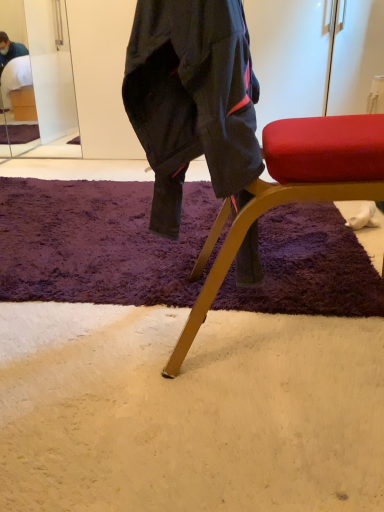
Question: From the image's perspective, is purple shaggy rug at center below metallic gold chair at center?

Choices:
 (A) yes
 (B) no

Answer: (A)

Question: Does purple shaggy rug at center have a greater width compared to metallic gold chair at center?

Choices:
 (A) no
 (B) yes

Answer: (B)

Question: Is the position of purple shaggy rug at center less distant than that of metallic gold chair at center?

Choices:
 (A) yes
 (B) no

Answer: (B)

Question: Is purple shaggy rug at center aimed at metallic gold chair at center?

Choices:
 (A) yes
 (B) no

Answer: (B)

Question: Can you confirm if purple shaggy rug at center is positioned to the left of metallic gold chair at center?

Choices:
 (A) yes
 (B) no

Answer: (A)

Question: From a real-world perspective, is purple shaggy rug at center physically above metallic gold chair at center?

Choices:
 (A) no
 (B) yes

Answer: (A)

Question: Does purple shaggy rug at center come behind clear glass mirror at upper left?

Choices:
 (A) no
 (B) yes

Answer: (A)

Question: Can you confirm if purple shaggy rug at center is thinner than clear glass mirror at upper left?

Choices:
 (A) no
 (B) yes

Answer: (A)

Question: Can we say purple shaggy rug at center lies outside clear glass mirror at upper left?

Choices:
 (A) yes
 (B) no

Answer: (A)

Question: Can you confirm if purple shaggy rug at center is shorter than clear glass mirror at upper left?

Choices:
 (A) no
 (B) yes

Answer: (B)

Question: Considering the relative positions of purple shaggy rug at center and clear glass mirror at upper left in the image provided, is purple shaggy rug at center to the left of clear glass mirror at upper left from the viewer's perspective?

Choices:
 (A) yes
 (B) no

Answer: (B)

Question: Would you say purple shaggy rug at center is a long distance from clear glass mirror at upper left?

Choices:
 (A) no
 (B) yes

Answer: (B)

Question: From the image's perspective, is metallic gold chair at center located above purple shaggy rug at center?

Choices:
 (A) no
 (B) yes

Answer: (B)